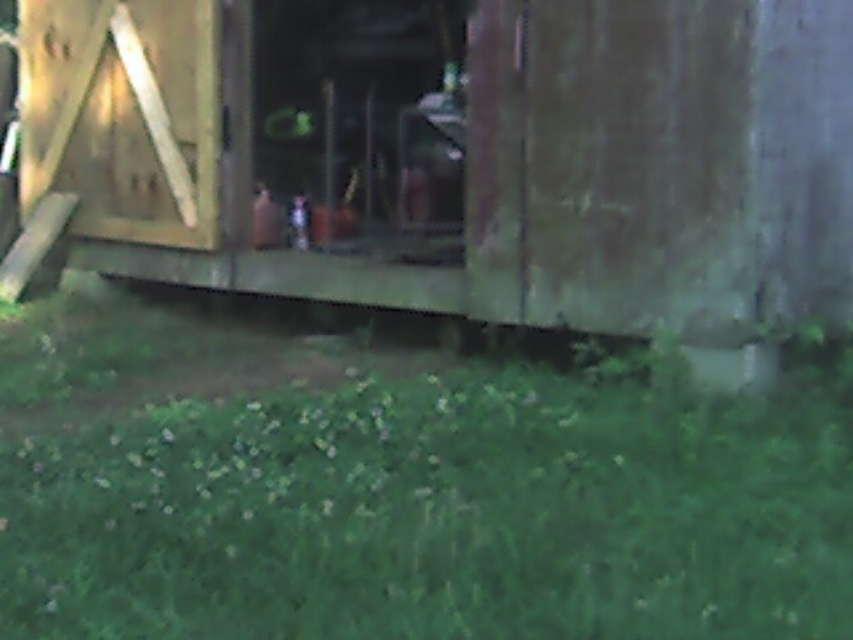
Is green grass at lower center taller than wooden hut at center?

No, green grass at lower center is not taller than wooden hut at center.

From the picture: Is green grass at lower center above wooden hut at center?

Incorrect, green grass at lower center is not positioned above wooden hut at center.

This screenshot has width=853, height=640. Describe the element at coordinates (405, 477) in the screenshot. I see `green grass at lower center` at that location.

Find the location of a particular element. This screenshot has width=853, height=640. green grass at lower center is located at coordinates (405, 477).